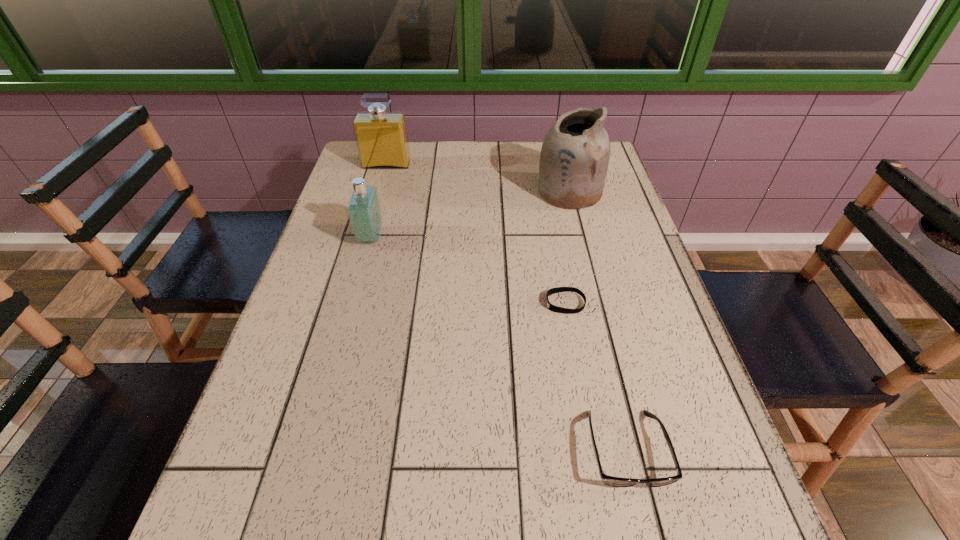
Find the location of `empty space between the pottery and the second nearest object`. empty space between the pottery and the second nearest object is located at coordinates [567, 247].

Identify the location of free space between the second shortest object and the shorter perfume. This screenshot has height=540, width=960. (498, 343).

You are a GUI agent. You are given a task and a screenshot of the screen. Output one action in this format:
    pyautogui.click(x=<x>, y=<y>)
    Task: Click on the empty space between the spectacles and the wristband
    The height and width of the screenshot is (540, 960).
    Given the screenshot: What is the action you would take?
    pyautogui.click(x=595, y=376)

Identify the location of vacant space that's between the farther perfume and the second nearest object. (475, 234).

Find the location of a particular element. The height and width of the screenshot is (540, 960). free space between the farthest object and the nearest object is located at coordinates point(506,307).

Find the location of `object that stands as the third closest to the second farthest object`. object that stands as the third closest to the second farthest object is located at coordinates (363, 208).

Identify which object is the fourth closest to the nearest object. Please provide its 2D coordinates. Your answer should be formatted as a tuple, i.e. [(x, y)], where the tuple contains the x and y coordinates of a point satisfying the conditions above.

[(381, 137)]

Identify the location of blank space that satisfies the following two spatial constraints: 1. on the front-facing side of the pottery; 2. on the right side of the farthest object. The image size is (960, 540). (379, 192).

At what (x,y) coordinates should I click in order to perform the action: click on vacant space that satisfies the following two spatial constraints: 1. on the front-facing side of the second farthest object; 2. on the right side of the farther perfume. Please return your answer as a coordinate pair (x, y). Looking at the image, I should click on (379, 192).